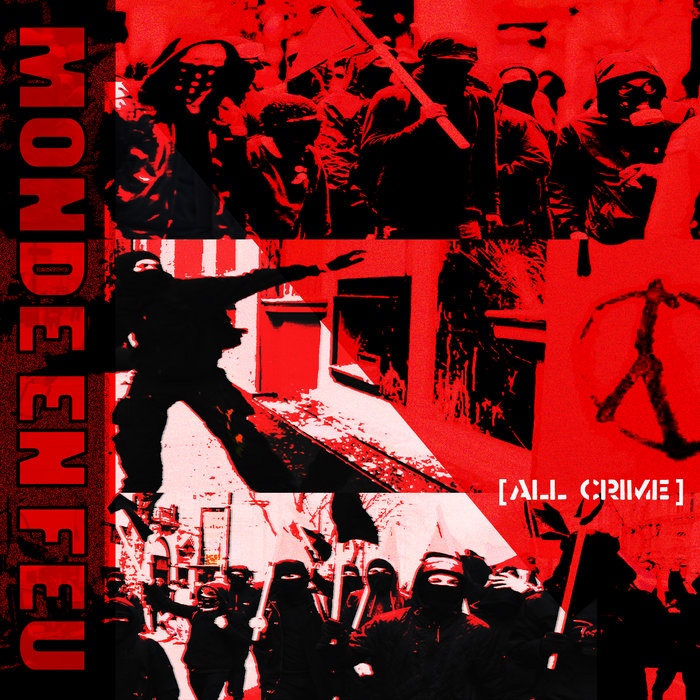
Where is `brackets`? This screenshot has height=700, width=700. brackets is located at coordinates (682, 484), (500, 484).